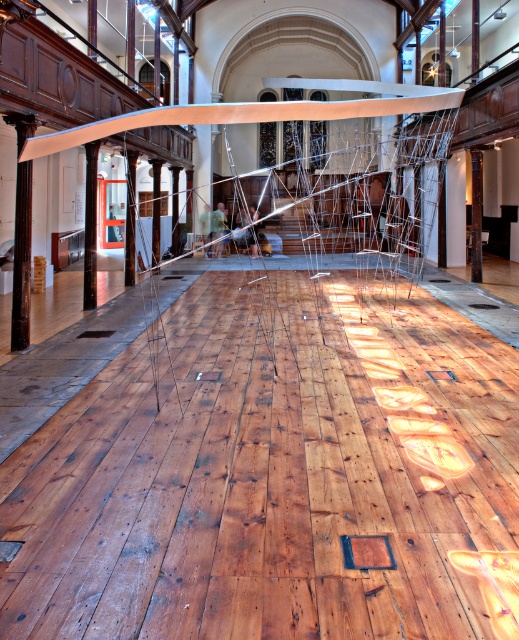
Looking at this image, you are an art curator planning to install a new sculpture in the gallery. You need to place a new sculpture that requires a clear path between the metallic wire at center and the white metallic beam at upper center. Is there enough space for a 1.2 meter wide sculpture to fit between them?

The metallic wire at center is to the right of the white metallic beam at upper center, but the description does not provide specific measurements of the distance between them. Therefore, it is unclear if there is enough space for a 1.2 meter wide sculpture between them.

You are an art curator planning to install a new sculpture that requires a support structure. The sculpture is 1 meter wide. Based on the image, can the metallic wire at center and the white metallic beam at upper center accommodate the sculpture if placed on the narrower of the two?

The metallic wire at center has a lesser width compared to white metallic beam at upper center. Since the sculpture is 1 meter wide, it would need to be placed on the wider white metallic beam at upper center. However, the description only states the wire is narrower, but does not provide exact measurements for either. Without knowing the actual width of the beam, it is uncertain if it can support the sculpture.